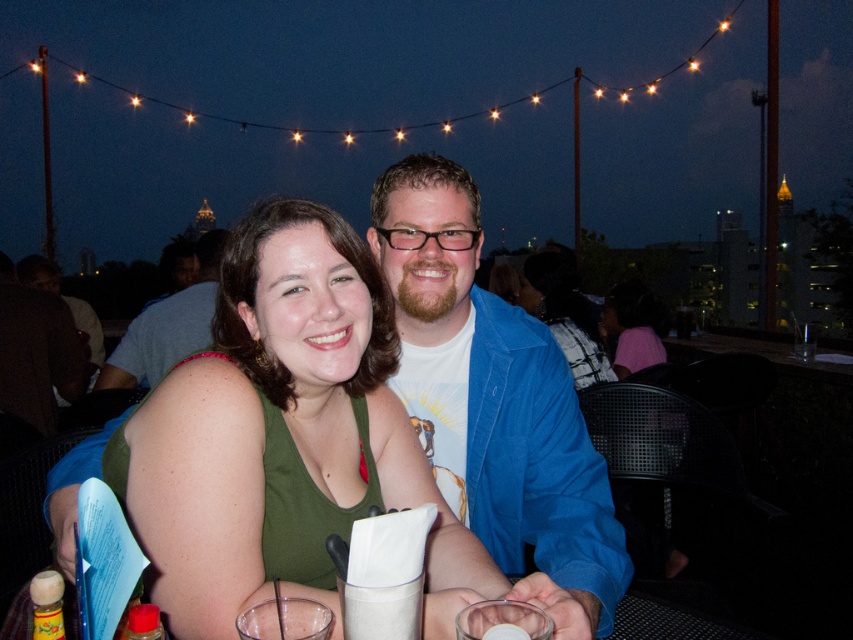
You are a photographer trying to capture a clear shot of both the blue cotton shirt at center and the blue denim jacket at upper center. Since you want to ensure both are in focus, you need to know which one is closer to the camera. Can you determine which is nearer based on their sizes?

The blue cotton shirt at center has a smaller size compared to the blue denim jacket at upper center, so the blue denim jacket at upper center is closer to the camera.

You are a photographer taking a picture of the two people at the table. You want to ensure both the green fabric tank top at center and the blue denim jacket at upper center are clearly visible in the frame. Which clothing item should you focus on first to ensure it doesn t get cut off?

The green fabric tank top at center is not as tall as the blue denim jacket at upper center, so you should focus on the blue denim jacket at upper center first since it is taller and might be more likely to be cut off if not properly framed.

You are a photographer trying to capture a candid shot of the two people at the table. You notice the green fabric tank top at center and the blue denim jacket at upper center. Which clothing item is positioned closer to the camera?

The green fabric tank top at center is closer to the viewer than the blue denim jacket at upper center, so the photographer should focus on the green fabric tank top at center for a clearer shot.